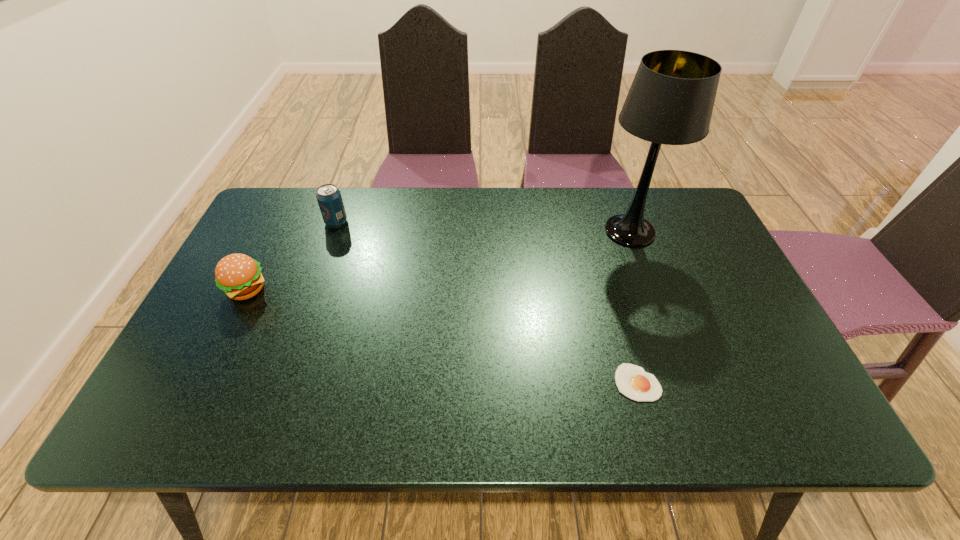
This screenshot has height=540, width=960. Identify the location of table lamp that is at the far edge. click(x=671, y=99).

Identify the location of pop soda located at the far edge. (329, 198).

At what (x,y) coordinates should I click in order to perform the action: click on object positioned at the near edge. Please return your answer as a coordinate pair (x, y). Looking at the image, I should click on (631, 380).

Identify the location of object that is at the left edge. (238, 275).

At what (x,y) coordinates should I click in order to perform the action: click on object positioned at the right edge. Please return your answer as a coordinate pair (x, y). Looking at the image, I should click on (671, 99).

Where is `object situated at the far right corner`? Image resolution: width=960 pixels, height=540 pixels. object situated at the far right corner is located at coordinates (671, 99).

Identify the location of vacant space at the far edge. The image size is (960, 540). (375, 210).

This screenshot has width=960, height=540. In the image, there is a desktop. In order to click on vacant space at the near edge in this screenshot , I will do `click(557, 413)`.

Find the location of `vacant region at the left edge of the desktop`. vacant region at the left edge of the desktop is located at coordinates (229, 355).

Locate an element on the screen. The height and width of the screenshot is (540, 960). vacant region at the right edge is located at coordinates (767, 350).